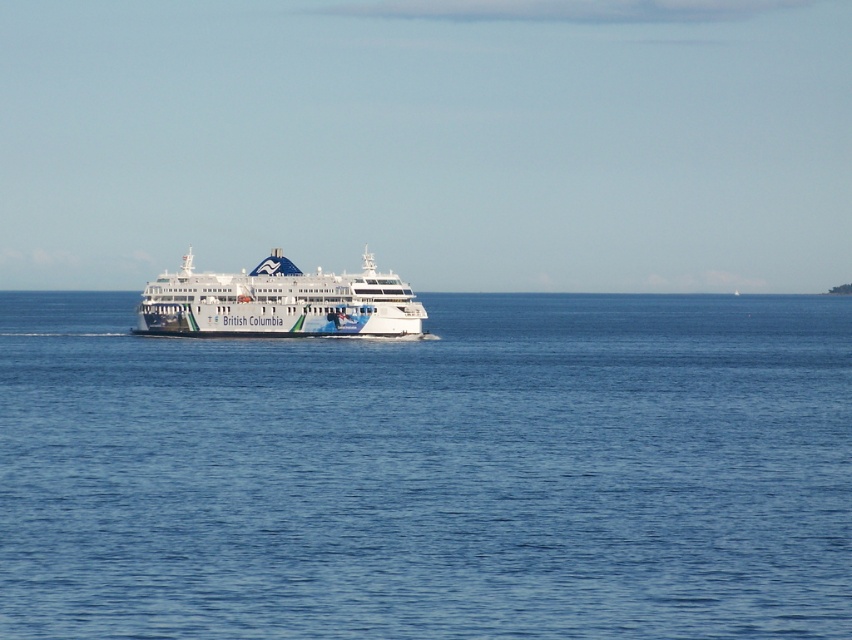
You are standing on the deck of the ferry British Columbia and looking out at the scene. There are two points marked on the horizon. One is at point coordinates point (838,346) and the other at point (373,272). Which point is closer to you?

Point (373,272) is closer to you because it is less further away than point (838,346).